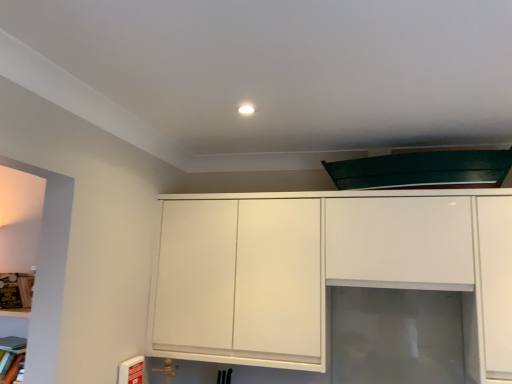
This screenshot has width=512, height=384. Describe the element at coordinates (321, 269) in the screenshot. I see `white glossy cabinet at center` at that location.

You are a GUI agent. You are given a task and a screenshot of the screen. Output one action in this format:
    pyautogui.click(x=<x>, y=<y>)
    Task: Click on the white glossy cabinet at center
    This screenshot has height=384, width=512.
    Given the screenshot: What is the action you would take?
    pyautogui.click(x=321, y=269)

Measure the distance between point (393, 333) and camera.

A distance of 2.06 meters exists between point (393, 333) and camera.

Where is `white glossy cabinet at center`? This screenshot has height=384, width=512. white glossy cabinet at center is located at coordinates click(321, 269).

From a real-world perspective, is white glossy cabinet at center physically above transparent glass door at center?

Yes, from a real-world perspective, white glossy cabinet at center is on top of transparent glass door at center.

Is point (502, 334) positioned in front of point (356, 345)?

That is True.

Is white glossy cabinet at center in front of transparent glass door at center?

Yes, the depth of white glossy cabinet at center is less than that of transparent glass door at center.

Considering the sizes of objects wooden bookshelf at left and white glossy cabinet at center in the image provided, who is wider, wooden bookshelf at left or white glossy cabinet at center?

white glossy cabinet at center.

Based on the photo, does wooden bookshelf at left appear on the left side of white glossy cabinet at center?

Yes, wooden bookshelf at left is to the left of white glossy cabinet at center.

Is wooden bookshelf at left far from white glossy cabinet at center?

Yes.

Does wooden bookshelf at left have a larger size compared to white glossy cabinet at center?

No.

Is white glossy cabinet at center facing towards wooden bookshelf at left?

No, white glossy cabinet at center is not oriented towards wooden bookshelf at left.

Which is farther from the camera, (304, 311) or (27, 279)?

The point (304, 311) is farther.

Is white glossy cabinet at center with wooden bookshelf at left?

No, white glossy cabinet at center is not making contact with wooden bookshelf at left.

In the image, there is a wooden bookshelf at left. At what (x,y) coordinates should I click in order to perform the action: click on cabinetry above it (from the image's perspective). Please return your answer as a coordinate pair (x, y). Looking at the image, I should click on click(321, 269).

In terms of width, does transparent glass door at center look wider or thinner when compared to wooden bookshelf at left?

In the image, transparent glass door at center appears to be more narrow than wooden bookshelf at left.

From a real-world perspective, does transparent glass door at center sit lower than wooden bookshelf at left?

Correct, in the physical world, transparent glass door at center is lower than wooden bookshelf at left.

In the image, is transparent glass door at center positioned in front of or behind wooden bookshelf at left?

transparent glass door at center is positioned closer to the viewer than wooden bookshelf at left.

How distant is transparent glass door at center from wooden bookshelf at left?

transparent glass door at center is 1.57 meters from wooden bookshelf at left.

Does wooden bookshelf at left have a lesser width compared to transparent glass door at center?

Incorrect, the width of wooden bookshelf at left is not less than that of transparent glass door at center.

Locate an element on the screen. The width and height of the screenshot is (512, 384). shelf located above the transparent glass door at center (from a real-world perspective) is located at coordinates (16, 292).

Can you confirm if wooden bookshelf at left is positioned to the right of transparent glass door at center?

No, wooden bookshelf at left is not to the right of transparent glass door at center.

Is wooden bookshelf at left spatially inside transparent glass door at center, or outside of it?

wooden bookshelf at left is not enclosed by transparent glass door at center.

Is white glossy cabinet at center located within transparent glass door at center?

No, white glossy cabinet at center is not inside transparent glass door at center.

From the image's perspective, which object appears higher, transparent glass door at center or white glossy cabinet at center?

white glossy cabinet at center, from the image's perspective.

Can you confirm if transparent glass door at center is shorter than white glossy cabinet at center?

Yes.

In terms of size, does transparent glass door at center appear bigger or smaller than white glossy cabinet at center?

Considering their sizes, transparent glass door at center takes up less space than white glossy cabinet at center.

I want to click on glass door below the white glossy cabinet at center (from a real-world perspective), so pyautogui.click(x=396, y=336).

In the image, there is a wooden bookshelf at left. Where is `cabinetry above it (from the image's perspective)`? cabinetry above it (from the image's perspective) is located at coordinates (321, 269).

Estimate the real-world distances between objects in this image. Which object is closer to wooden bookshelf at left, transparent glass door at center or white glossy cabinet at center?

Among the two, white glossy cabinet at center is located nearer to wooden bookshelf at left.

Considering their positions, is transparent glass door at center positioned further to white glossy cabinet at center than wooden bookshelf at left?

The object further to white glossy cabinet at center is wooden bookshelf at left.

Looking at the image, which one is located closer to transparent glass door at center, white glossy cabinet at center or wooden bookshelf at left?

white glossy cabinet at center is closer to transparent glass door at center.

Consider the image. From the image, which object appears to be nearer to transparent glass door at center, wooden bookshelf at left or white glossy cabinet at center?

white glossy cabinet at center lies closer to transparent glass door at center than the other object.

Based on their spatial positions, is wooden bookshelf at left or transparent glass door at center further from white glossy cabinet at center?

Among the two, wooden bookshelf at left is located further to white glossy cabinet at center.

From the image, which object appears to be nearer to wooden bookshelf at left, white glossy cabinet at center or transparent glass door at center?

The object closer to wooden bookshelf at left is white glossy cabinet at center.

Where is `cabinetry between wooden bookshelf at left and transparent glass door at center`? cabinetry between wooden bookshelf at left and transparent glass door at center is located at coordinates (321, 269).